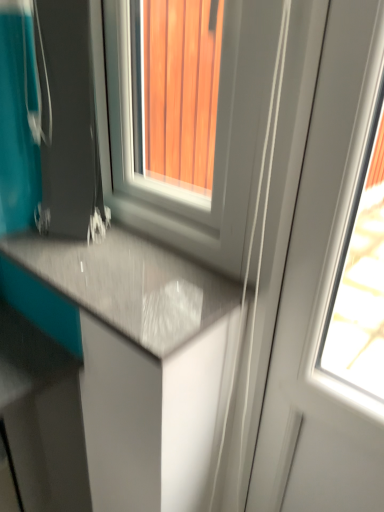
This screenshot has height=512, width=384. I want to click on white glossy window at center, so click(215, 140).

What do you see at coordinates (129, 285) in the screenshot?
I see `matte gray countertop at lower left` at bounding box center [129, 285].

The height and width of the screenshot is (512, 384). I want to click on white glossy window at center, so click(215, 140).

Does white glossy window at center contain matte black suitcase at lower left?

Actually, matte black suitcase at lower left is outside white glossy window at center.

Considering the positions of objects white glossy window at center and matte black suitcase at lower left in the image provided, who is in front, white glossy window at center or matte black suitcase at lower left?

white glossy window at center is closer to the camera.

Considering the relative sizes of white glossy window at center and matte black suitcase at lower left in the image provided, is white glossy window at center bigger than matte black suitcase at lower left?

Correct, white glossy window at center is larger in size than matte black suitcase at lower left.

In the image, is white glossy window at center on the left side or the right side of matte black suitcase at lower left?

Based on their positions, white glossy window at center is located to the right of matte black suitcase at lower left.

Between white glossy screen door at right and matte gray countertop at lower left, which one has larger width?

Wider between the two is matte gray countertop at lower left.

Consider the image. Is white glossy screen door at right touching matte gray countertop at lower left?

There is a gap between white glossy screen door at right and matte gray countertop at lower left.

Who is shorter, white glossy screen door at right or matte gray countertop at lower left?

matte gray countertop at lower left.

Is matte gray countertop at lower left located within white glossy screen door at right?

Actually, matte gray countertop at lower left is outside white glossy screen door at right.

In terms of size, does matte gray countertop at lower left appear bigger or smaller than matte black suitcase at lower left?

Clearly, matte gray countertop at lower left is smaller in size than matte black suitcase at lower left.

In the scene shown: Can you confirm if matte gray countertop at lower left is wider than matte black suitcase at lower left?

Yes.

This screenshot has height=512, width=384. I want to click on countertop below the matte black suitcase at lower left (from a real-world perspective), so click(129, 285).

Is white glossy window at center closer to the viewer compared to matte gray countertop at lower left?

Yes, white glossy window at center is closer to the viewer.

Which of these two, white glossy window at center or matte gray countertop at lower left, is smaller?

matte gray countertop at lower left.

Which is behind, point (122, 2) or point (96, 291)?

The point (122, 2) is farther.

What's the angular difference between white glossy window at center and matte gray countertop at lower left's facing directions?

The angle between the facing direction of white glossy window at center and the facing direction of matte gray countertop at lower left is 0.292 degrees.

Is white glossy screen door at right far from white glossy window at center?

No, there isn't a large distance between white glossy screen door at right and white glossy window at center.

Which object is positioned more to the right, white glossy screen door at right or white glossy window at center?

white glossy screen door at right.

Based on the photo, who is smaller, white glossy screen door at right or white glossy window at center?

With smaller size is white glossy screen door at right.

The image size is (384, 512). In order to click on screen door in front of the white glossy window at center in this screenshot , I will do `click(323, 297)`.

Does matte gray countertop at lower left come behind white glossy window at center?

That is True.

Measure the distance between matte gray countertop at lower left and white glossy window at center.

6.63 inches.

From a real-world perspective, is matte gray countertop at lower left physically located above or below white glossy window at center?

In terms of real-world spatial position, matte gray countertop at lower left is below white glossy window at center.

Does point (219, 291) appear closer or farther from the camera than point (128, 197)?

Clearly, point (219, 291) is closer to the camera than point (128, 197).

Is matte black suitcase at lower left not near matte gray countertop at lower left?

They are positioned close to each other.

Which is less distant, (60, 225) or (170, 324)?

Point (60, 225).

Is matte black suitcase at lower left inside the boundaries of matte gray countertop at lower left, or outside?

matte black suitcase at lower left is not enclosed by matte gray countertop at lower left.

Which object is further away from the camera, matte black suitcase at lower left or matte gray countertop at lower left?

matte gray countertop at lower left.

Find the location of `window lying in front of the matte black suitcase at lower left`. window lying in front of the matte black suitcase at lower left is located at coordinates (215, 140).

What are the coordinates of `countertop behind the white glossy screen door at right` in the screenshot? It's located at (129, 285).

In the scene shown: Considering their positions, is matte black suitcase at lower left positioned further to white glossy screen door at right than white glossy window at center?

The object further to white glossy screen door at right is matte black suitcase at lower left.

Considering their positions, is white glossy screen door at right positioned further to matte black suitcase at lower left than matte gray countertop at lower left?

Among the two, white glossy screen door at right is located further to matte black suitcase at lower left.

In the scene shown: From the image, which object appears to be nearer to matte black suitcase at lower left, white glossy window at center or white glossy screen door at right?

Among the two, white glossy window at center is located nearer to matte black suitcase at lower left.

Based on their spatial positions, is white glossy screen door at right or white glossy window at center closer to matte black suitcase at lower left?

Based on the image, white glossy window at center appears to be nearer to matte black suitcase at lower left.

When comparing their distances from white glossy screen door at right, does matte gray countertop at lower left or matte black suitcase at lower left seem further?

Based on the image, matte black suitcase at lower left appears to be further to white glossy screen door at right.

From the image, which object appears to be nearer to white glossy window at center, matte gray countertop at lower left or matte black suitcase at lower left?

Based on the image, matte black suitcase at lower left appears to be nearer to white glossy window at center.

Looking at the image, which one is located further to white glossy window at center, matte gray countertop at lower left or white glossy screen door at right?

white glossy screen door at right is positioned further to the anchor white glossy window at center.

Estimate the real-world distances between objects in this image. Which object is closer to white glossy screen door at right, white glossy window at center or matte gray countertop at lower left?

Among the two, white glossy window at center is located nearer to white glossy screen door at right.

Where is `countertop between white glossy window at center and white glossy screen door at right in the vertical direction`? The height and width of the screenshot is (512, 384). countertop between white glossy window at center and white glossy screen door at right in the vertical direction is located at coordinates (129, 285).

The height and width of the screenshot is (512, 384). In order to click on appliance that lies between white glossy window at center and matte gray countertop at lower left from top to bottom in this screenshot , I will do `click(68, 123)`.

Identify the location of countertop between matte black suitcase at lower left and white glossy screen door at right. (129, 285).

I want to click on appliance between white glossy window at center and white glossy screen door at right in the up-down direction, so click(x=68, y=123).